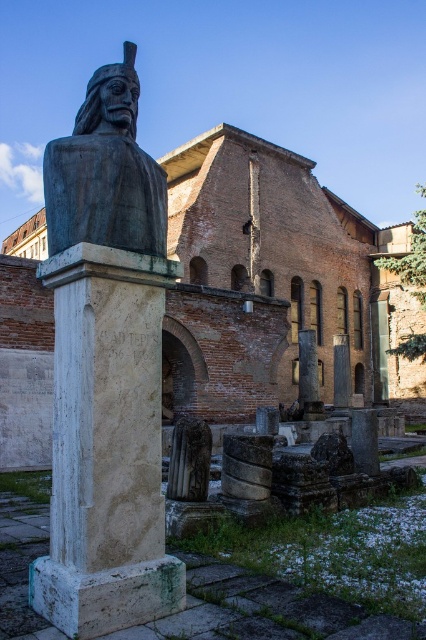
Question: Does bronze statue at center appear over smooth stone column at center?

Choices:
 (A) no
 (B) yes

Answer: (B)

Question: Which object is the farthest from the carved stone statue at center?

Choices:
 (A) smooth stone column at center
 (B) white marble column at center

Answer: (A)

Question: In this image, where is brick wall at center located relative to smooth gray stone pillar at center?

Choices:
 (A) left
 (B) right

Answer: (A)

Question: Among these objects, which one is nearest to the camera?

Choices:
 (A) white marble column at center
 (B) smooth stone column at center

Answer: (A)

Question: Can you confirm if bronze statue at center is wider than smooth stone pillar at center?

Choices:
 (A) no
 (B) yes

Answer: (B)

Question: Estimate the real-world distances between objects in this image. Which object is closer to the brick wall at center?

Choices:
 (A) carved stone statue at center
 (B) smooth gray stone pillar at center
 (C) white marble column at center

Answer: (C)